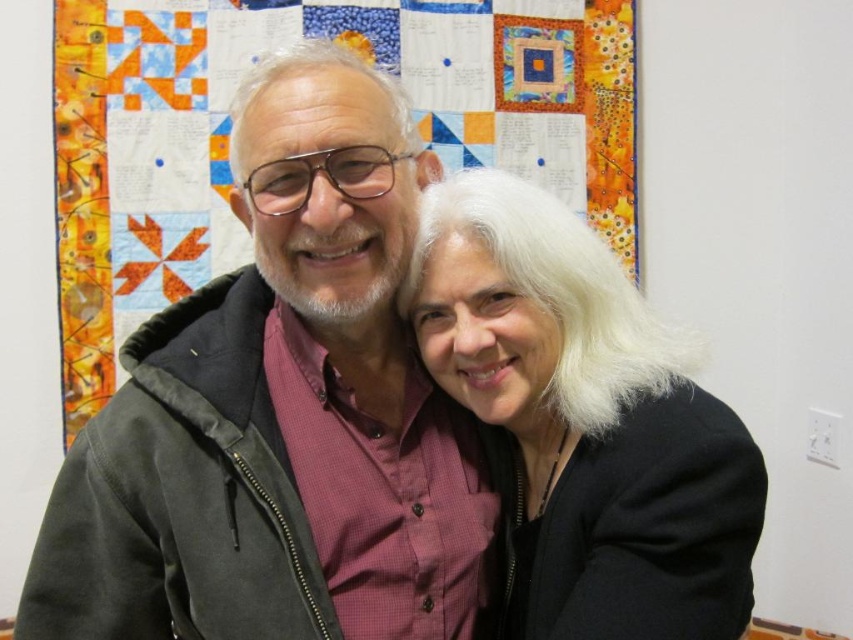
Which is in front, point (119, 444) or point (622, 369)?

Point (119, 444) is more forward.

Is the position of matte black jacket at center less distant than that of white matte hair at center?

No, it is behind white matte hair at center.

Is point (105, 568) behind point (756, 532)?

Yes, point (105, 568) is behind point (756, 532).

Where is `matte black jacket at center`? This screenshot has height=640, width=853. matte black jacket at center is located at coordinates (282, 412).